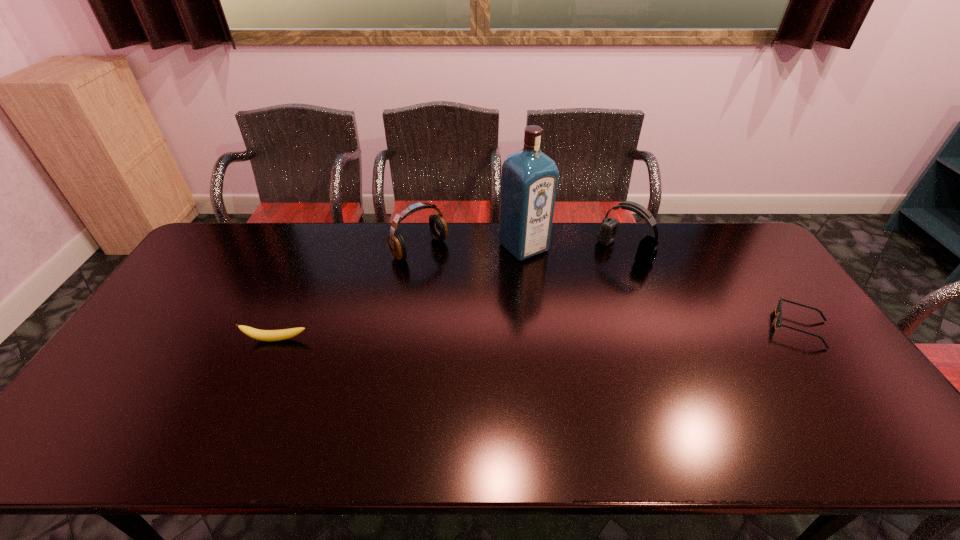
This screenshot has height=540, width=960. I want to click on vacant space on the desktop that is between the leftmost object and the shortest object and is positioned on the ear cups of the fourth object from right to left, so click(x=517, y=334).

This screenshot has width=960, height=540. In order to click on free space on the desktop that is between the fourth tallest object and the sunglasses and is positioned on the flat label side of the liquor in this screenshot , I will do `click(615, 332)`.

The width and height of the screenshot is (960, 540). Identify the location of vacant space on the desktop that is between the leftmost object and the shortest object and is positioned on the headband of the right headset. (518, 334).